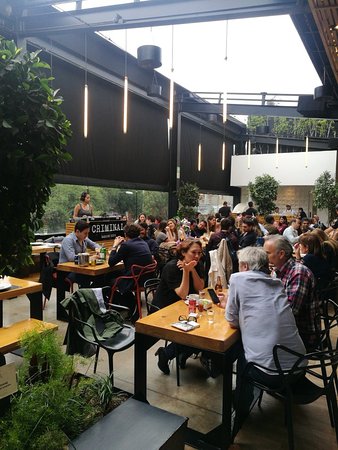
Identify the location of restaurant. (195, 168).